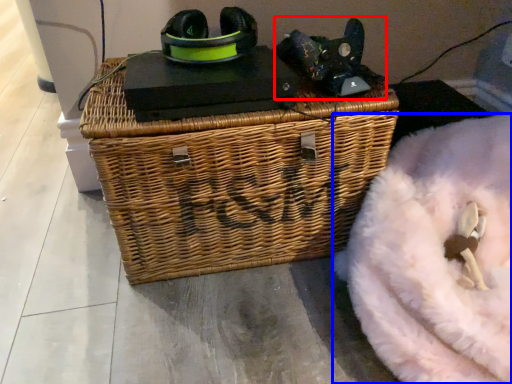
Question: Which of the following is the closest to the observer, bean bag chair (highlighted by a red box) or bean bag chair (highlighted by a blue box)?

Choices:
 (A) bean bag chair
 (B) bean bag chair

Answer: (B)